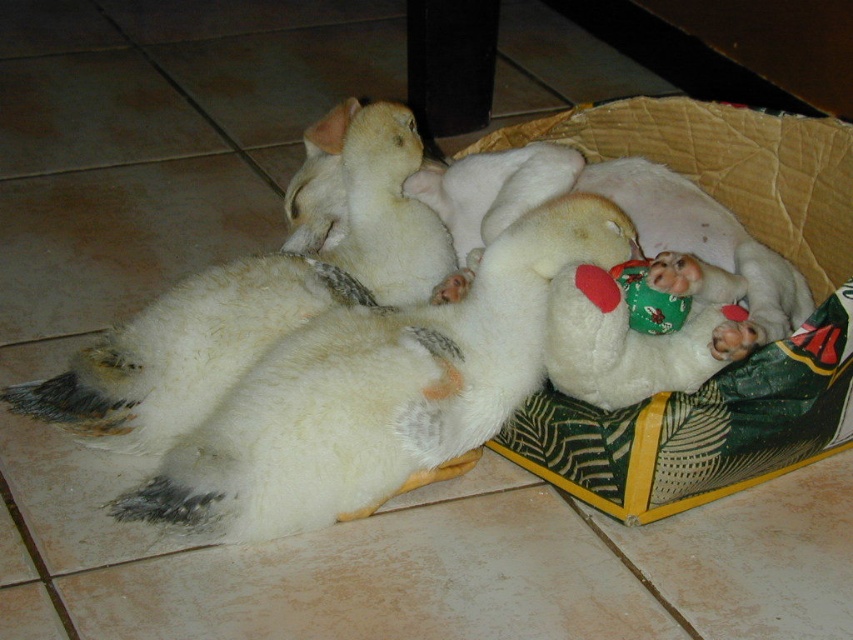
Is cardboard basket at center to the left of white plush bear at center from the viewer's perspective?

In fact, cardboard basket at center is to the right of white plush bear at center.

This screenshot has height=640, width=853. What do you see at coordinates (733, 364) in the screenshot?
I see `cardboard basket at center` at bounding box center [733, 364].

Which is in front, point (845, 280) or point (608, 308)?

Point (608, 308)

The height and width of the screenshot is (640, 853). In order to click on cardboard basket at center in this screenshot , I will do `click(733, 364)`.

From the picture: Does white fluffy dog at center come in front of white plush bear at center?

No.

Is point (271, 369) farther from viewer compared to point (579, 284)?

That is True.

Find the location of a particular element. The image size is (853, 640). white fluffy dog at center is located at coordinates (376, 390).

Between white fluffy dog at center and cardboard basket at center, which one has less height?

Standing shorter between the two is cardboard basket at center.

Between white fluffy dog at center and cardboard basket at center, which one appears on the right side from the viewer's perspective?

Positioned to the right is cardboard basket at center.

This screenshot has height=640, width=853. What are the coordinates of `white fluffy dog at center` in the screenshot? It's located at (376, 390).